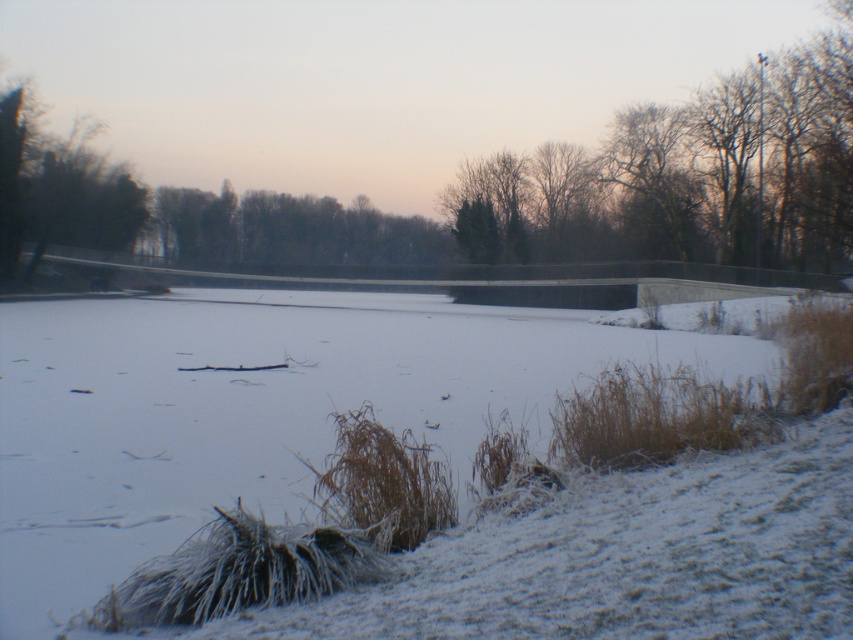
Looking at this image, you are a hiker trying to cross the frozen pond. You see the green leafy trees at center and the green leafy tree at left. Which tree is closer to your starting point?

The green leafy tree at left is closer to your starting point because the distance between them is 15.48 meters, so the tree at left is nearer than the trees at center.

You are an architect designing a new park and want to incorporate both the bare branches at upper center and the green leafy tree at left into the design. Which of these two objects has a greater width?

The bare branches at upper center has a greater width than the green leafy tree at left according to the description.

You are an artist planning to paint the winter scene. You want to highlight the contrast between the bare branches at upper center and the green leafy trees at center. Which object should you make larger in your painting to emphasize this contrast?

To emphasize the contrast, you should make the bare branches at upper center larger in your painting since they are bigger than the green leafy trees at center in the scene.